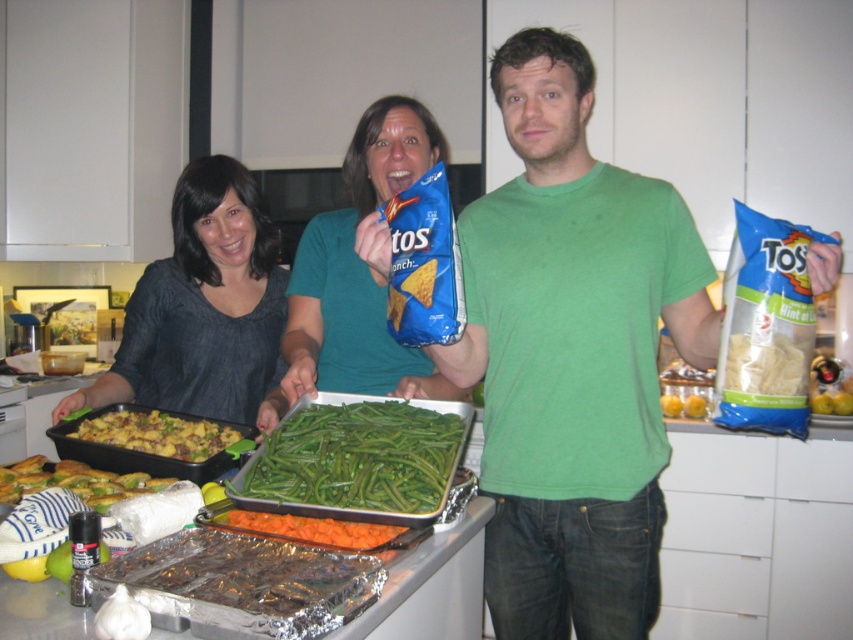
Which is in front, point (344, 515) or point (4, 465)?

Positioned in front is point (344, 515).

Is green smooth/texture green beans at center to the left of golden crispy chicken at center from the viewer's perspective?

No, green smooth/texture green beans at center is not to the left of golden crispy chicken at center.

Which is in front, point (358, 440) or point (155, 477)?

Point (358, 440) is in front.

Where is `green smooth/texture green beans at center`? green smooth/texture green beans at center is located at coordinates (357, 460).

Who is lower down, matte brown chips at right or orange glazed carrots at center?

Positioned lower is orange glazed carrots at center.

Who is positioned more to the left, matte brown chips at right or orange glazed carrots at center?

From the viewer's perspective, orange glazed carrots at center appears more on the left side.

This screenshot has height=640, width=853. I want to click on matte brown chips at right, so (764, 365).

Which is in front, point (315, 369) or point (222, 429)?

Point (315, 369)

From the picture: Can you confirm if blue matte tortilla chips at center is smaller than golden brown crumbly mixture at center?

No.

Is point (315, 289) behind point (166, 420)?

That is True.

The height and width of the screenshot is (640, 853). Identify the location of blue matte tortilla chips at center. (360, 269).